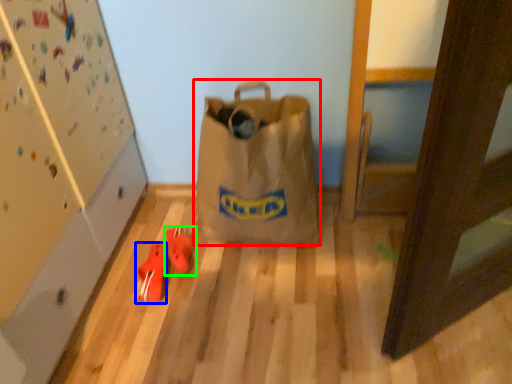
Question: Which is nearer to the luggage and bags (highlighted by a red box)? footwear (highlighted by a blue box) or footwear (highlighted by a green box).

Choices:
 (A) footwear
 (B) footwear

Answer: (B)